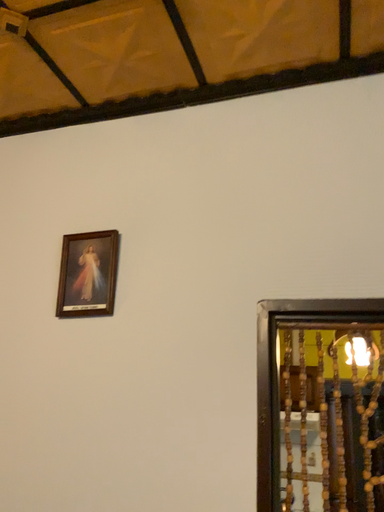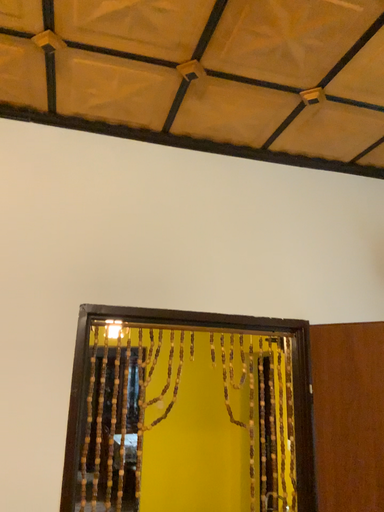
Question: How did the camera likely rotate when shooting the video?

Choices:
 (A) rotated downward
 (B) rotated upward

Answer: (A)